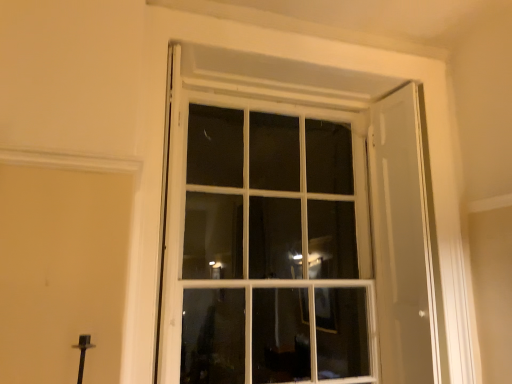
This screenshot has height=384, width=512. Describe the element at coordinates (83, 353) in the screenshot. I see `black plastic door handle at lower left` at that location.

What are the coordinates of `black plastic door handle at lower left` in the screenshot? It's located at (83, 353).

The image size is (512, 384). In order to click on black plastic door handle at lower left in this screenshot , I will do `click(83, 353)`.